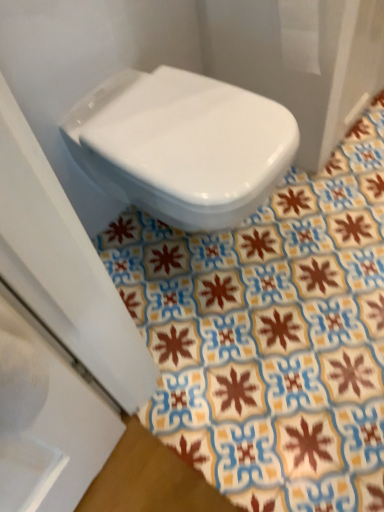
What is the approximate height of white glossy screen door at lower left?

white glossy screen door at lower left is 14.39 inches in height.

The height and width of the screenshot is (512, 384). I want to click on white glossy screen door at lower left, so click(x=48, y=424).

What do you see at coordinates (48, 424) in the screenshot? I see `white glossy screen door at lower left` at bounding box center [48, 424].

Locate an element on the screen. This screenshot has height=512, width=384. white glossy screen door at lower left is located at coordinates (48, 424).